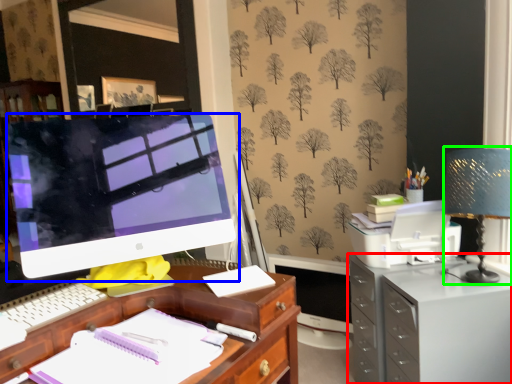
Question: Estimate the real-world distances between objects in this image. Which object is farther from filing cabinet (highlighted by a red box), computer monitor (highlighted by a blue box) or table lamp (highlighted by a green box)?

Choices:
 (A) computer monitor
 (B) table lamp

Answer: (A)